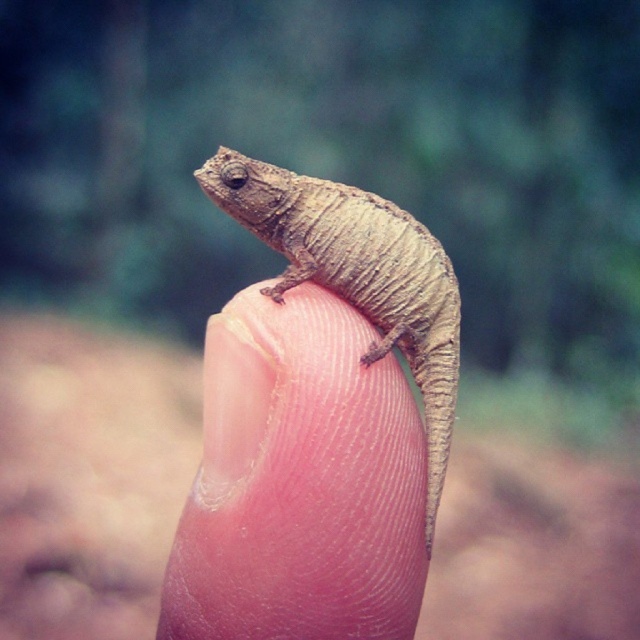
You are a biologist observing a lizard on a human hand. You notice two brown objects at the center of the image. Which one is positioned lower between the brown rough skin at center and the brown textured lizard at center?

The brown rough skin at center is located below the brown textured lizard at center, so the brown rough skin at center is positioned lower.

You are a researcher studying the habitat of the lizard. You notice a point marked at coordinate (300, 483) in the image. Based on the scene description, what surface is this point located on?

The point marked at coordinate (300, 483) is located on the brown rough skin at center, which is part of the human finger shown in the image.

You are a biologist examining a closeup image of a human finger with a lizard. You need to determine which object is bigger between the brown rough skin at center and the brown textured lizard at center. Which one is larger?

The brown rough skin at center is larger in size than the brown textured lizard at center according to the description.